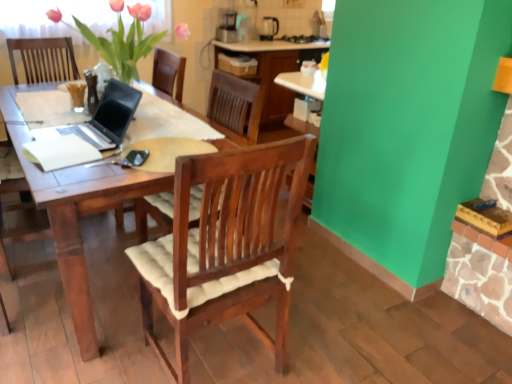
The image size is (512, 384). What do you see at coordinates (123, 40) in the screenshot?
I see `pink matte vase at upper left` at bounding box center [123, 40].

What is the approximate height of wooden laptop at left?

38.91 inches.

Where is `white paper at center`? The width and height of the screenshot is (512, 384). white paper at center is located at coordinates (60, 152).

What do you see at coordinates (268, 28) in the screenshot? The image size is (512, 384). I see `matte black coffee maker at upper center` at bounding box center [268, 28].

What is the approximate height of matte black laptop at left?

matte black laptop at left is 9.85 inches in height.

Where is `matte black laptop at left`? This screenshot has height=384, width=512. matte black laptop at left is located at coordinates (103, 119).

In order to click on pink matte vase at upper left in this screenshot , I will do `click(123, 40)`.

Who is more distant, pink matte vase at upper left or matte black coffee maker at upper center?

matte black coffee maker at upper center is more distant.

From a real-world perspective, who is located lower, pink matte vase at upper left or matte black coffee maker at upper center?

matte black coffee maker at upper center, from a real-world perspective.

Could you tell me if pink matte vase at upper left is facing matte black coffee maker at upper center?

No, pink matte vase at upper left is not turned towards matte black coffee maker at upper center.

From the picture: Is pink matte vase at upper left far from matte black coffee maker at upper center?

Yes.

Can you confirm if matte black coffee maker at upper center is smaller than matte black laptop at left?

Yes, matte black coffee maker at upper center is smaller than matte black laptop at left.

From the image's perspective, is matte black coffee maker at upper center over matte black laptop at left?

Yes, from the image's perspective, matte black coffee maker at upper center is above matte black laptop at left.

From a real-world perspective, which object rests below the other?

matte black laptop at left.

How different are the orientations of matte black coffee maker at upper center and matte black laptop at left in degrees?

85.5 degrees separate the facing orientations of matte black coffee maker at upper center and matte black laptop at left.

From a real-world perspective, is pink matte vase at upper left positioned under matte black laptop at left based on gravity?

Actually, pink matte vase at upper left is physically above matte black laptop at left in the real world.

Are pink matte vase at upper left and matte black laptop at left beside each other?

No, pink matte vase at upper left is not making contact with matte black laptop at left.

Considering the relative positions of pink matte vase at upper left and matte black laptop at left in the image provided, is pink matte vase at upper left to the left of matte black laptop at left from the viewer's perspective?

No, pink matte vase at upper left is not to the left of matte black laptop at left.

Does point (80, 24) lie in front of point (74, 140)?

That is False.

Are pink matte vase at upper left and white paper at center located far from each other?

That's not correct — pink matte vase at upper left is a little close to white paper at center.

Is pink matte vase at upper left turned away from white paper at center?

No.

Is pink matte vase at upper left outside of white paper at center?

Yes, pink matte vase at upper left is outside of white paper at center.

From the image's perspective, is white paper at center above wooden laptop at left?

No, from the image's perspective, white paper at center is not on top of wooden laptop at left.

Identify the location of notepad on the right of wooden laptop at left. The width and height of the screenshot is (512, 384). (60, 152).

From the picture: From a real-world perspective, between white paper at center and wooden laptop at left, who is vertically higher?

white paper at center.

Which object is closer to the camera taking this photo, matte black laptop at left or wooden laptop at left?

matte black laptop at left is in front.

Does point (120, 133) come closer to viewer compared to point (15, 39)?

Yes, point (120, 133) is in front of point (15, 39).

Could you tell me if matte black laptop at left is turned towards wooden laptop at left?

No.

Visually, is matte black laptop at left positioned to the left or to the right of wooden laptop at left?

In the image, matte black laptop at left appears on the right side of wooden laptop at left.

Is white paper at center far from matte black laptop at left?

No, white paper at center is in close proximity to matte black laptop at left.

Which object is further away from the camera, white paper at center or matte black laptop at left?

white paper at center.

Which is farther, (x=64, y=148) or (x=114, y=138)?

The point (x=114, y=138) is behind.

Is white paper at center to the right of matte black laptop at left from the viewer's perspective?

No.

Where is `floral arrangement lying in front of the matte black coffee maker at upper center`? This screenshot has height=384, width=512. floral arrangement lying in front of the matte black coffee maker at upper center is located at coordinates (123, 40).

The height and width of the screenshot is (384, 512). What are the coordinates of `appliance above the matte black laptop at left (from a real-world perspective)` in the screenshot? It's located at (268, 28).

Based on their spatial positions, is wooden laptop at left or pink matte vase at upper left further from matte black coffee maker at upper center?

pink matte vase at upper left is positioned further to the anchor matte black coffee maker at upper center.

Estimate the real-world distances between objects in this image. Which object is closer to white paper at center, wooden laptop at left or pink matte vase at upper left?

pink matte vase at upper left.

Looking at the image, which one is located further to wooden laptop at left, white paper at center or pink matte vase at upper left?

Among the two, white paper at center is located further to wooden laptop at left.

Looking at the image, which one is located further to pink matte vase at upper left, white paper at center or matte black laptop at left?

The object further to pink matte vase at upper left is white paper at center.

Looking at this image, when comparing their distances from matte black coffee maker at upper center, does white paper at center or matte black laptop at left seem closer?

matte black laptop at left.

Which object lies nearer to the anchor point white paper at center, pink matte vase at upper left or matte black coffee maker at upper center?

Based on the image, pink matte vase at upper left appears to be nearer to white paper at center.

In the scene shown: Estimate the real-world distances between objects in this image. Which object is closer to matte black laptop at left, pink matte vase at upper left or matte black coffee maker at upper center?

pink matte vase at upper left.

From the image, which object appears to be nearer to matte black laptop at left, wooden laptop at left or pink matte vase at upper left?

pink matte vase at upper left is positioned closer to the anchor matte black laptop at left.

Locate an element on the screen. The width and height of the screenshot is (512, 384). notepad between matte black laptop at left and matte black coffee maker at upper center in the front-back direction is located at coordinates (60, 152).

At what (x,y) coordinates should I click in order to perform the action: click on floral arrangement between matte black laptop at left and wooden laptop at left from front to back. Please return your answer as a coordinate pair (x, y). This screenshot has height=384, width=512. Looking at the image, I should click on (123, 40).

This screenshot has width=512, height=384. Find the location of `floral arrangement between white paper at center and wooden laptop at left in the front-back direction`. floral arrangement between white paper at center and wooden laptop at left in the front-back direction is located at coordinates (123, 40).

The width and height of the screenshot is (512, 384). I want to click on floral arrangement between white paper at center and matte black coffee maker at upper center along the z-axis, so click(123, 40).